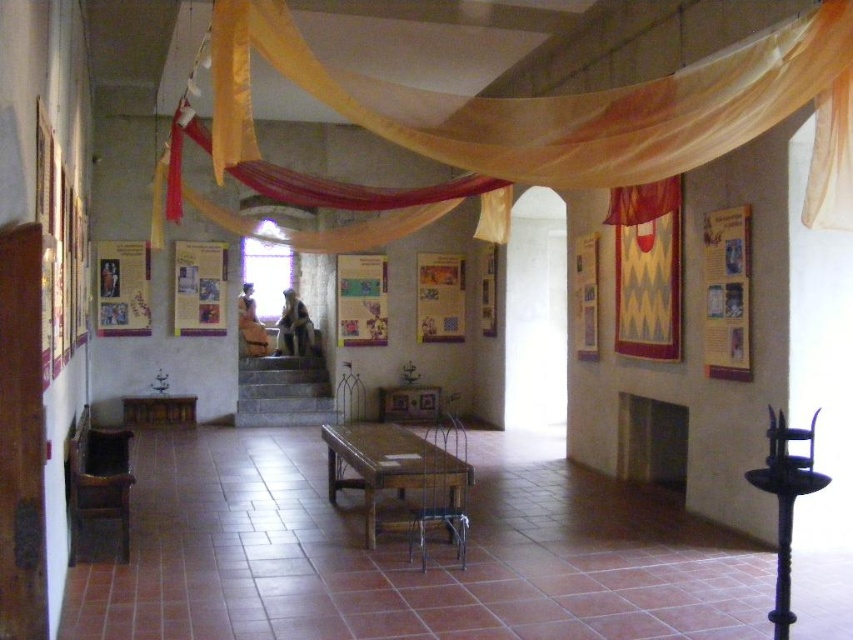
Is the position of translucent yellow fabric at upper center more distant than that of wooden table at center?

No, it is in front of wooden table at center.

Looking at this image, between translucent yellow fabric at upper center and wooden table at center, which one is positioned lower?

wooden table at center is lower down.

The width and height of the screenshot is (853, 640). What are the coordinates of `translucent yellow fabric at upper center` in the screenshot? It's located at (569, 109).